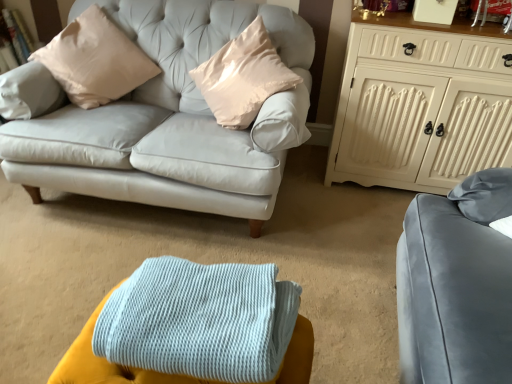
Describe the element at coordinates (200, 320) in the screenshot. I see `light blue knitted blanket at lower center` at that location.

Locate an element on the screen. The height and width of the screenshot is (384, 512). white painted wood cabinet at upper right is located at coordinates (421, 105).

Image resolution: width=512 pixels, height=384 pixels. I want to click on light blue knitted blanket at lower center, so click(x=200, y=320).

Can you confirm if white painted wood cabinet at upper right is taller than satin beige pillow at upper left?

Indeed, white painted wood cabinet at upper right has a greater height compared to satin beige pillow at upper left.

Looking at this image, is white painted wood cabinet at upper right not within satin beige pillow at upper left?

Absolutely, white painted wood cabinet at upper right is external to satin beige pillow at upper left.

From a real-world perspective, is white painted wood cabinet at upper right over satin beige pillow at upper left?

Incorrect, from a real-world perspective, white painted wood cabinet at upper right is lower than satin beige pillow at upper left.

From the image's perspective, is white painted wood cabinet at upper right beneath satin beige pillow at upper left?

Yes, from the image's perspective, white painted wood cabinet at upper right is beneath satin beige pillow at upper left.

Measure the distance between light blue knitted blanket at lower center and white painted wood cabinet at upper right.

light blue knitted blanket at lower center is 4.34 feet from white painted wood cabinet at upper right.

From the image's perspective, is light blue knitted blanket at lower center below white painted wood cabinet at upper right?

Yes.

Considering the sizes of objects light blue knitted blanket at lower center and white painted wood cabinet at upper right in the image provided, who is wider, light blue knitted blanket at lower center or white painted wood cabinet at upper right?

Wider between the two is white painted wood cabinet at upper right.

From a real-world perspective, who is located higher, light blue knitted blanket at lower center or white painted wood cabinet at upper right?

white painted wood cabinet at upper right, from a real-world perspective.

Does satin beige pillow at upper left have a greater height compared to light blue knitted blanket at lower center?

Correct, satin beige pillow at upper left is much taller as light blue knitted blanket at lower center.

Consider the image. Are satin beige pillow at upper left and light blue knitted blanket at lower center making contact?

No, satin beige pillow at upper left is not making contact with light blue knitted blanket at lower center.

Could you tell me if satin beige pillow at upper left is facing light blue knitted blanket at lower center?

Yes, satin beige pillow at upper left is oriented towards light blue knitted blanket at lower center.

In the image, is light blue knitted blanket at lower center positioned in front of or behind satin beige pillow at upper left?

Clearly, light blue knitted blanket at lower center is in front of satin beige pillow at upper left.

From a real-world perspective, which object stands above the other?

From a 3D spatial view, satin beige pillow at upper left is above.

Is point (115, 338) in front of point (116, 30)?

That is True.

Is light blue knitted blanket at lower center next to satin beige pillow at upper left and touching it?

No, light blue knitted blanket at lower center is not next to satin beige pillow at upper left.

Does point (66, 64) lie in front of point (476, 85)?

No, (66, 64) is behind (476, 85).

From the image's perspective, is satin beige pillow at upper left beneath white painted wood cabinet at upper right?

No, from the image's perspective, satin beige pillow at upper left is not beneath white painted wood cabinet at upper right.

Can you confirm if satin beige pillow at upper left is positioned to the right of white painted wood cabinet at upper right?

In fact, satin beige pillow at upper left is to the left of white painted wood cabinet at upper right.

Between white painted wood cabinet at upper right and light blue knitted blanket at lower center, which one appears on the right side from the viewer's perspective?

From the viewer's perspective, white painted wood cabinet at upper right appears more on the right side.

From the picture: From the image's perspective, is white painted wood cabinet at upper right located above or below light blue knitted blanket at lower center?

white painted wood cabinet at upper right is situated higher than light blue knitted blanket at lower center in the image.

What's the angular difference between white painted wood cabinet at upper right and light blue knitted blanket at lower center's facing directions?

The facing directions of white painted wood cabinet at upper right and light blue knitted blanket at lower center are 2.84 degrees apart.

I want to click on cabinetry in front of the satin beige pillow at upper left, so click(421, 105).

The image size is (512, 384). What are the coordinates of `cabinetry above the light blue knitted blanket at lower center (from the image's perspective)` in the screenshot? It's located at (421, 105).

Estimate the real-world distances between objects in this image. Which object is closer to light blue knitted blanket at lower center, satin beige pillow at upper left or white painted wood cabinet at upper right?

white painted wood cabinet at upper right.

Estimate the real-world distances between objects in this image. Which object is further from light blue knitted blanket at lower center, white painted wood cabinet at upper right or satin beige pillow at upper left?

satin beige pillow at upper left is positioned further to the anchor light blue knitted blanket at lower center.

Considering their positions, is white painted wood cabinet at upper right positioned further to satin beige pillow at upper left than light blue knitted blanket at lower center?

Based on the image, light blue knitted blanket at lower center appears to be further to satin beige pillow at upper left.

Considering their positions, is light blue knitted blanket at lower center positioned further to satin beige pillow at upper left than white painted wood cabinet at upper right?

The object further to satin beige pillow at upper left is light blue knitted blanket at lower center.

When comparing their distances from white painted wood cabinet at upper right, does satin beige pillow at upper left or light blue knitted blanket at lower center seem closer?

Among the two, satin beige pillow at upper left is located nearer to white painted wood cabinet at upper right.

Based on their spatial positions, is light blue knitted blanket at lower center or satin beige pillow at upper left closer to white painted wood cabinet at upper right?

Based on the image, satin beige pillow at upper left appears to be nearer to white painted wood cabinet at upper right.

Identify the location of blanket situated between satin beige pillow at upper left and white painted wood cabinet at upper right from left to right. (200, 320).